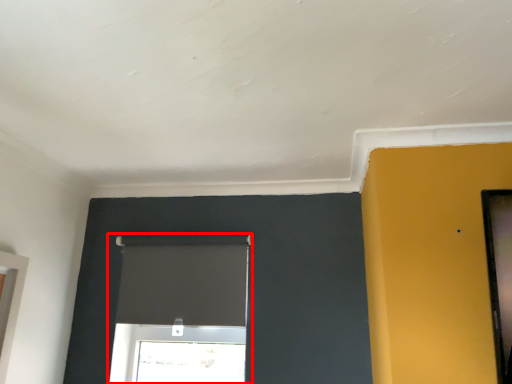
Question: From the image's perspective, what is the correct spatial positioning of window (annotated by the red box) in reference to window?

Choices:
 (A) above
 (B) below

Answer: (A)